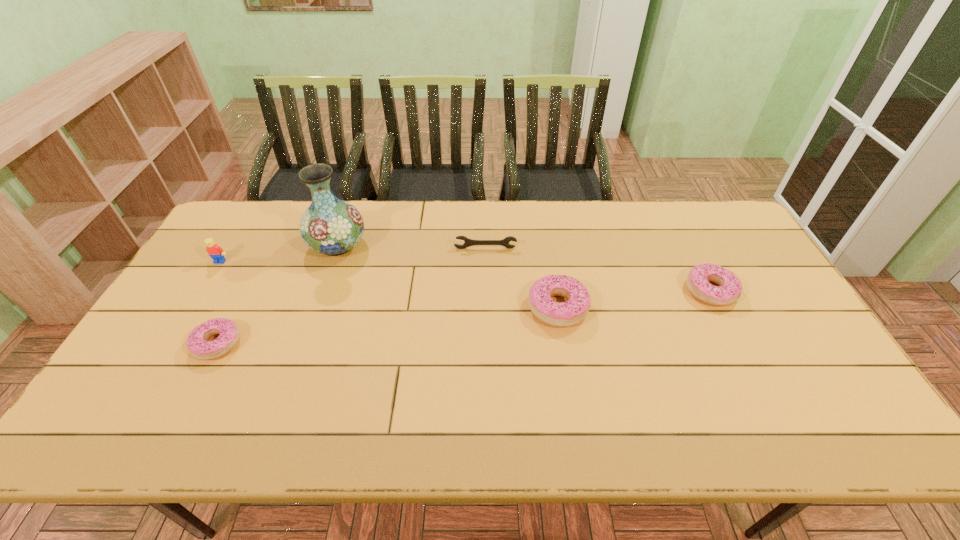
The height and width of the screenshot is (540, 960). Identify the location of the second object from left to right. (197, 344).

Find the location of `the shortest doughnut`. the shortest doughnut is located at coordinates [x=197, y=344].

At what (x,y) coordinates should I click in order to perform the action: click on the second doughnut from right to left. Please return your answer as a coordinate pair (x, y). This screenshot has height=540, width=960. Looking at the image, I should click on (560, 314).

At what (x,y) coordinates should I click in order to perform the action: click on the rightmost object. Please return your answer as a coordinate pair (x, y). This screenshot has height=540, width=960. Looking at the image, I should click on (730, 287).

The width and height of the screenshot is (960, 540). I want to click on the rightmost doughnut, so click(730, 287).

Where is `the third object from left to right`? Image resolution: width=960 pixels, height=540 pixels. the third object from left to right is located at coordinates (330, 226).

You are a GUI agent. You are given a task and a screenshot of the screen. Output one action in this format:
    pyautogui.click(x=<x>, y=<y>)
    Task: Click on the vase
    
    Given the screenshot: What is the action you would take?
    pyautogui.click(x=330, y=226)

In order to click on the fourth object from left to right in this screenshot , I will do `click(468, 242)`.

The width and height of the screenshot is (960, 540). I want to click on the fifth shortest object, so click(215, 252).

You are a GUI agent. You are given a task and a screenshot of the screen. Output one action in this format:
    pyautogui.click(x=<x>, y=<y>)
    Task: Click on the Lego
    This screenshot has width=960, height=540.
    Given the screenshot: What is the action you would take?
    pyautogui.click(x=215, y=252)